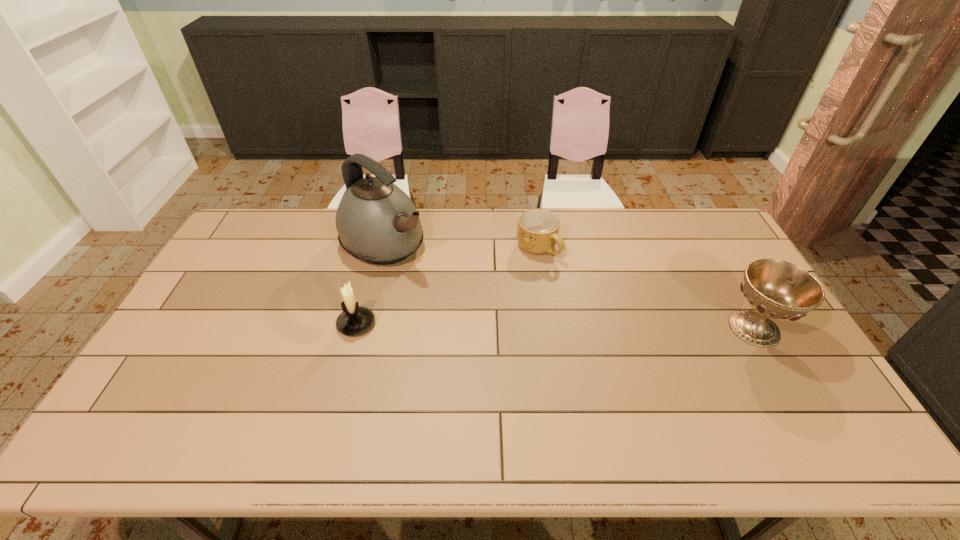
Identify the location of candle holder. This screenshot has height=540, width=960. (354, 320).

Find the location of a particular element. Image resolution: width=960 pixels, height=540 pixels. the rightmost object is located at coordinates (776, 289).

Find the location of `kettle`. kettle is located at coordinates (377, 222).

Where is `the second object from right to left`? The width and height of the screenshot is (960, 540). the second object from right to left is located at coordinates (537, 233).

You are a GUI agent. You are given a task and a screenshot of the screen. Output one action in this format:
    pyautogui.click(x=<x>, y=<y>)
    Task: Click on the shortest object
    This screenshot has height=540, width=960.
    Given the screenshot: What is the action you would take?
    537,233

This screenshot has height=540, width=960. I want to click on free location located 0.070m on the back of the candle holder, so click(x=365, y=293).

Where is `blank area located 0.400m on the back of the rightmost object`? Image resolution: width=960 pixels, height=540 pixels. blank area located 0.400m on the back of the rightmost object is located at coordinates tap(695, 225).

This screenshot has height=540, width=960. What are the coordinates of `vacant space located at the spout of the kettle` in the screenshot? It's located at (427, 272).

The height and width of the screenshot is (540, 960). I want to click on vacant space positioned at the spout of the kettle, so click(x=467, y=299).

I want to click on vacant space located at the spout of the kettle, so click(483, 310).